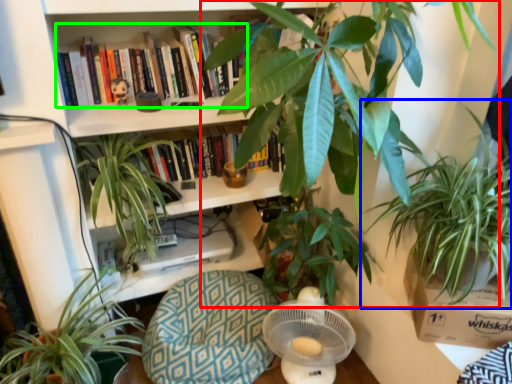
Question: Estimate the real-world distances between objects in this image. Which object is closer to houseplant (highlighted by a red box), houseplant (highlighted by a blue box) or book (highlighted by a green box)?

Choices:
 (A) houseplant
 (B) book

Answer: (A)